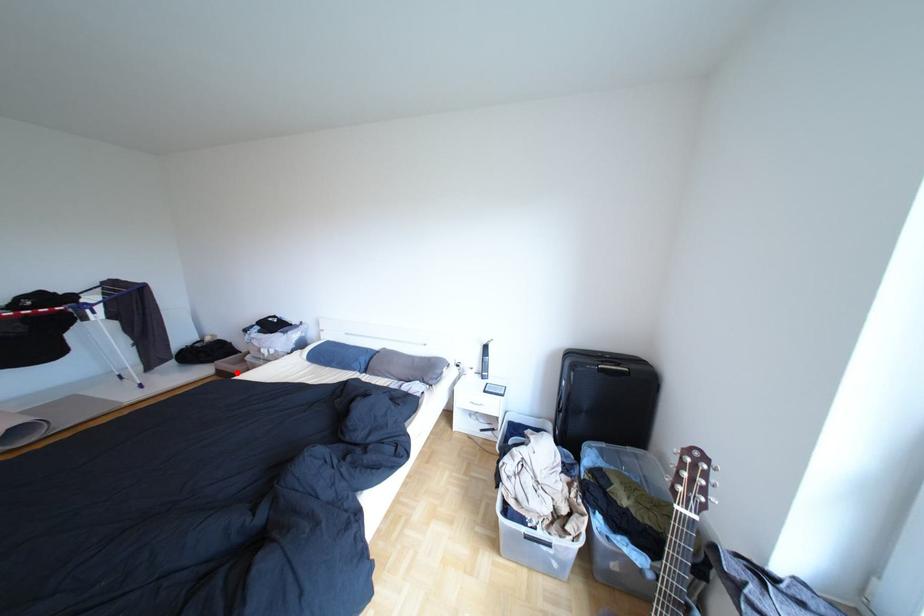
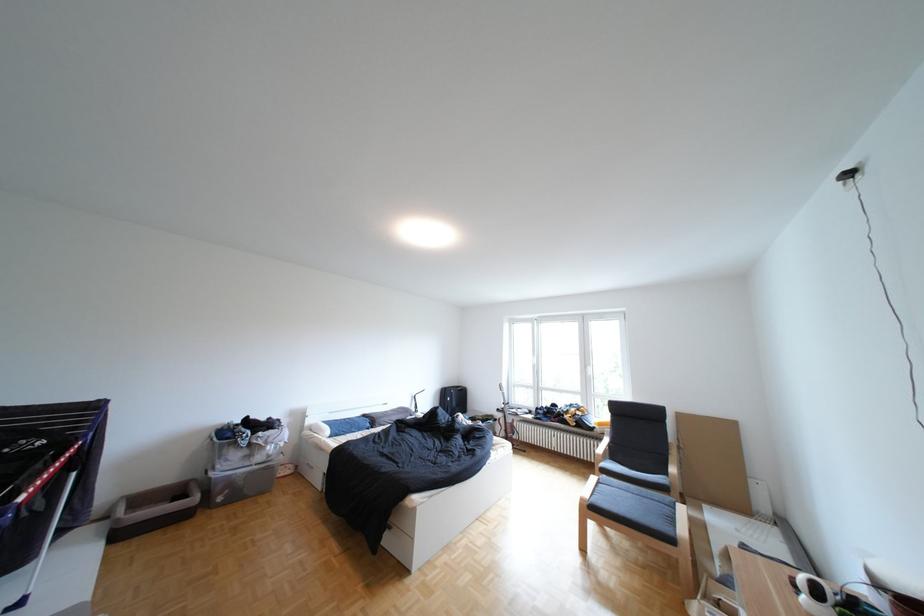
Where in the second image is the point corresponding to the highlighted location from the first image?

(136, 536)